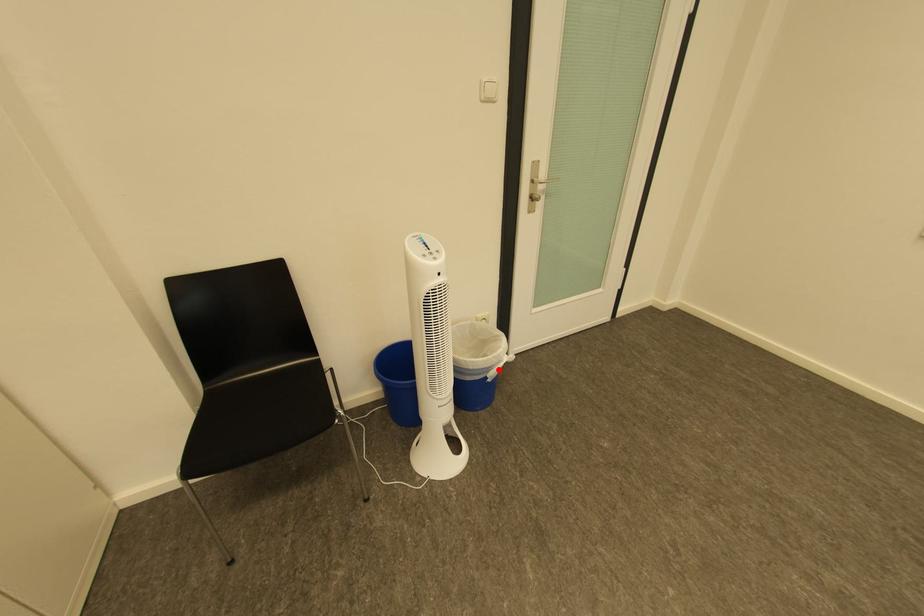
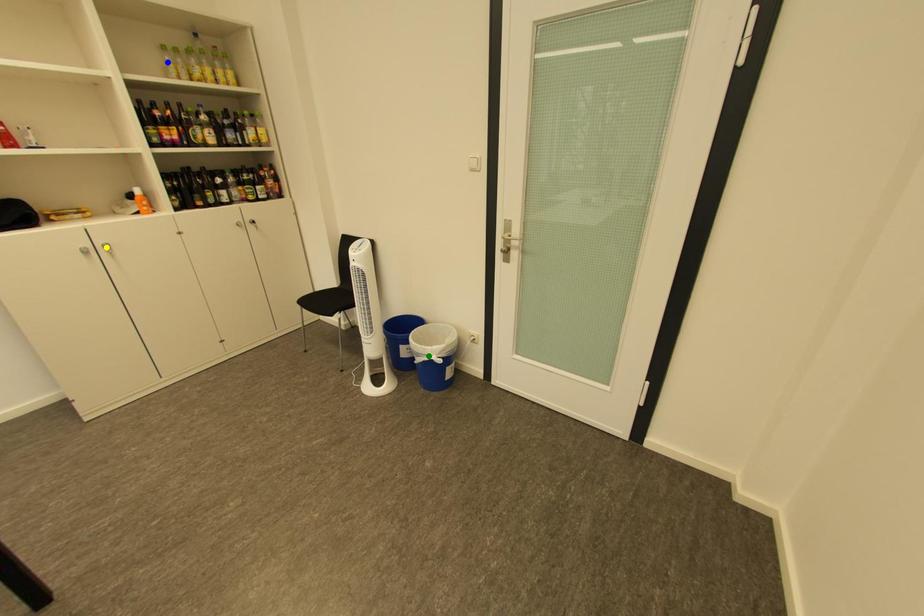
Question: I am providing you with two images of the same scene from different viewpoints. A red point is marked on the first image. You are given multiple points on the second image. Which mark in image 2 goes with the point in image 1?

Choices:
 (A) blue point
 (B) green point
 (C) yellow point

Answer: (B)